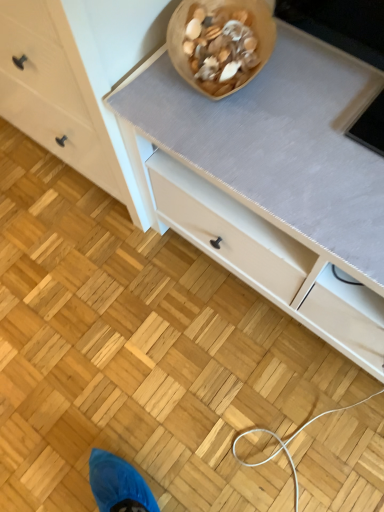
What do you see at coordinates (220, 47) in the screenshot? The image size is (384, 512). I see `wooden bowl at upper center` at bounding box center [220, 47].

At what (x,y) coordinates should I click in order to perform the action: click on wooden bowl at upper center. Please return your answer as a coordinate pair (x, y). The image size is (384, 512). Looking at the image, I should click on (220, 47).

Identify the location of white matte chest of drawers at lower left. The image size is (384, 512). (63, 93).

Measure the distance between white matte chest of drawers at lower left and camera.

white matte chest of drawers at lower left and camera are 64.64 centimeters apart.

What is the approximate height of white matte chest of drawers at lower left?

white matte chest of drawers at lower left is 31.15 inches tall.

Measure the distance between point (2, 35) and camera.

Point (2, 35) is 35.20 inches from camera.

The width and height of the screenshot is (384, 512). What do you see at coordinates (63, 93) in the screenshot?
I see `white matte chest of drawers at lower left` at bounding box center [63, 93].

The image size is (384, 512). I want to click on wooden bowl at upper center, so click(x=220, y=47).

Based on the photo, can you confirm if white matte chest of drawers at lower left is positioned to the right of wooden bowl at upper center?

No.

From the picture: Which object is further away from the camera taking this photo, white matte chest of drawers at lower left or wooden bowl at upper center?

wooden bowl at upper center is more distant.

Between point (49, 139) and point (214, 71), which one is positioned in front?

The point (214, 71) is in front.

From the image's perspective, is white matte chest of drawers at lower left located above wooden bowl at upper center?

Indeed, from the image's perspective, white matte chest of drawers at lower left is shown above wooden bowl at upper center.

From a real-world perspective, is white matte chest of drawers at lower left under wooden bowl at upper center?

Correct, in the physical world, white matte chest of drawers at lower left is lower than wooden bowl at upper center.

Does white matte chest of drawers at lower left have a lesser width compared to wooden bowl at upper center?

Incorrect, the width of white matte chest of drawers at lower left is not less than that of wooden bowl at upper center.

Who is taller, white matte chest of drawers at lower left or wooden bowl at upper center?

With more height is white matte chest of drawers at lower left.

Does white matte chest of drawers at lower left have a larger size compared to wooden bowl at upper center?

Yes.

Is white matte chest of drawers at lower left inside or outside of wooden bowl at upper center?

white matte chest of drawers at lower left is not inside wooden bowl at upper center, it's outside.

Is there a large distance between white matte chest of drawers at lower left and wooden bowl at upper center?

No, there isn't a large distance between white matte chest of drawers at lower left and wooden bowl at upper center.

Could you tell me if white matte chest of drawers at lower left is facing wooden bowl at upper center?

No, white matte chest of drawers at lower left is not aimed at wooden bowl at upper center.

How many degrees apart are the facing directions of white matte chest of drawers at lower left and wooden bowl at upper center?

There is a 28.2-degree angle between the facing directions of white matte chest of drawers at lower left and wooden bowl at upper center.

This screenshot has height=512, width=384. In order to click on food located above the white matte chest of drawers at lower left (from a real-world perspective) in this screenshot , I will do `click(220, 47)`.

Consider the image. Between wooden bowl at upper center and white matte chest of drawers at lower left, which one appears on the right side from the viewer's perspective?

From the viewer's perspective, wooden bowl at upper center appears more on the right side.

Between wooden bowl at upper center and white matte chest of drawers at lower left, which one is positioned in front?

Positioned in front is white matte chest of drawers at lower left.

Which point is more distant from viewer, (229, 71) or (102, 167)?

The point (102, 167) is more distant.

From the image's perspective, is wooden bowl at upper center positioned above or below white matte chest of drawers at lower left?

wooden bowl at upper center is situated lower than white matte chest of drawers at lower left in the image.

From a real-world perspective, is wooden bowl at upper center above or below white matte chest of drawers at lower left?

In terms of real-world spatial position, wooden bowl at upper center is above white matte chest of drawers at lower left.

Can you confirm if wooden bowl at upper center is wider than white matte chest of drawers at lower left?

No, wooden bowl at upper center is not wider than white matte chest of drawers at lower left.

Does wooden bowl at upper center have a lesser height compared to white matte chest of drawers at lower left?

Yes, wooden bowl at upper center is shorter than white matte chest of drawers at lower left.

Can you confirm if wooden bowl at upper center is smaller than white matte chest of drawers at lower left?

Correct, wooden bowl at upper center occupies less space than white matte chest of drawers at lower left.

Can we say wooden bowl at upper center lies outside white matte chest of drawers at lower left?

Absolutely, wooden bowl at upper center is external to white matte chest of drawers at lower left.

Are wooden bowl at upper center and white matte chest of drawers at lower left far apart?

Actually, wooden bowl at upper center and white matte chest of drawers at lower left are a little close together.

Could you tell me if wooden bowl at upper center is facing white matte chest of drawers at lower left?

No.

What's the angular difference between wooden bowl at upper center and white matte chest of drawers at lower left's facing directions?

They differ by 28.2 degrees in their facing directions.

At what (x,y) coordinates should I click in order to perform the action: click on chest of drawers that appears on the left of wooden bowl at upper center. Please return your answer as a coordinate pair (x, y). Looking at the image, I should click on (63, 93).

Image resolution: width=384 pixels, height=512 pixels. I want to click on the chest of drawers lying above the wooden bowl at upper center (from the image's perspective), so click(x=63, y=93).

At what (x,y) coordinates should I click in order to perform the action: click on food behind the white matte chest of drawers at lower left. Please return your answer as a coordinate pair (x, y). Looking at the image, I should click on (220, 47).